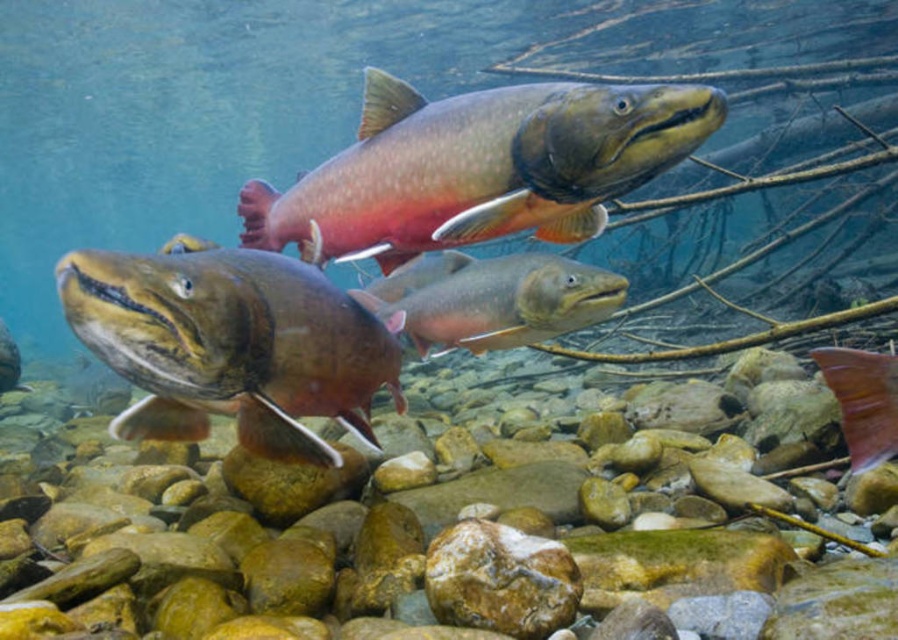
Which is below, smooth rock at center or shiny pinkish-orange fish at center?

smooth rock at center is below.

Does smooth rock at center appear on the left side of shiny pinkish-orange fish at center?

Yes, smooth rock at center is to the left of shiny pinkish-orange fish at center.

Who is more distant from viewer, (x=509, y=545) or (x=397, y=211)?

Point (x=397, y=211)

This screenshot has width=898, height=640. Find the location of `smooth rock at center`. smooth rock at center is located at coordinates tap(392, 548).

Is shiny orange fish at lower right above shiny pinkish salmon at center?

Correct, shiny orange fish at lower right is located above shiny pinkish salmon at center.

Which is in front, point (852, 396) or point (1, 378)?

Positioned in front is point (852, 396).

Is point (863, 380) in front of point (20, 385)?

Yes, point (863, 380) is closer to viewer.

At what (x,y) coordinates should I click in order to perform the action: click on shiny orange fish at lower right. Please return your answer as a coordinate pair (x, y). The height and width of the screenshot is (640, 898). Looking at the image, I should click on (863, 401).

Is shiny pinkish-orange fish at center to the right of shiny brown fish at center from the viewer's perspective?

Correct, you'll find shiny pinkish-orange fish at center to the right of shiny brown fish at center.

Does shiny pinkish-orange fish at center appear over shiny brown fish at center?

Yes, shiny pinkish-orange fish at center is above shiny brown fish at center.

Between point (568, 204) and point (155, 262), which one is positioned in front?

Point (155, 262) is more forward.

Find the location of a particular element. This screenshot has height=640, width=898. shiny pinkish-orange fish at center is located at coordinates (480, 168).